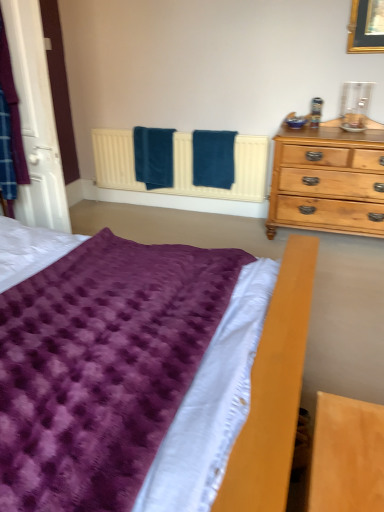
This screenshot has height=512, width=384. Describe the element at coordinates (127, 375) in the screenshot. I see `purple fuzzy blanket at lower left` at that location.

What is the approximate height of blue soft towel at center, which is the first bath towel from left to right?

blue soft towel at center, which is the first bath towel from left to right, is 21.89 inches in height.

I want to click on blue soft towel at center, marked as the second bath towel in a right-to-left arrangement, so [153, 157].

At what (x,y) coordinates should I click in order to perform the action: click on teal soft towel at center, the 1th bath towel from the right. Please return your answer as a coordinate pair (x, y). Looking at the image, I should click on [213, 158].

From the picture: Relative to teal soft towel at center, the 1th bath towel from the right, is purple fuzzy blanket at lower left in front or behind?

purple fuzzy blanket at lower left is in front of teal soft towel at center, the 1th bath towel from the right.

Is purple fuzzy blanket at lower left spatially inside teal soft towel at center, the 1th bath towel from the right, or outside of it?

purple fuzzy blanket at lower left is not inside teal soft towel at center, the 1th bath towel from the right, it's outside.

Is purple fuzzy blanket at lower left oriented away from teal soft towel at center, the 2th bath towel positioned from the left?

That's not correct — purple fuzzy blanket at lower left is not looking away from teal soft towel at center, the 2th bath towel positioned from the left.

From the picture: Considering the sizes of objects purple fuzzy blanket at lower left and teal soft towel at center, the 2th bath towel positioned from the left, in the image provided, who is taller, purple fuzzy blanket at lower left or teal soft towel at center, the 2th bath towel positioned from the left,?

purple fuzzy blanket at lower left.

Is teal soft towel at center, the 2th bath towel positioned from the left, in contact with purple fuzzy blanket at lower left?

No, teal soft towel at center, the 2th bath towel positioned from the left, is not making contact with purple fuzzy blanket at lower left.

Is teal soft towel at center, the 1th bath towel from the right, facing towards purple fuzzy blanket at lower left?

Yes, teal soft towel at center, the 1th bath towel from the right, is aimed at purple fuzzy blanket at lower left.

From a real-world perspective, is teal soft towel at center, the 2th bath towel positioned from the left, above or below purple fuzzy blanket at lower left?

In terms of real-world spatial position, teal soft towel at center, the 2th bath towel positioned from the left, is below purple fuzzy blanket at lower left.

Is teal soft towel at center, the 2th bath towel positioned from the left, wider than purple fuzzy blanket at lower left?

In fact, teal soft towel at center, the 2th bath towel positioned from the left, might be narrower than purple fuzzy blanket at lower left.

Can blue soft towel at center, which is the first bath towel from left to right, be found inside teal soft towel at center, the 1th bath towel from the right?

No, blue soft towel at center, which is the first bath towel from left to right, is not surrounded by teal soft towel at center, the 1th bath towel from the right.

Is teal soft towel at center, the 2th bath towel positioned from the left, not close to blue soft towel at center, marked as the second bath towel in a right-to-left arrangement?

No.

Can you confirm if teal soft towel at center, the 1th bath towel from the right, is bigger than blue soft towel at center, marked as the second bath towel in a right-to-left arrangement?

Actually, teal soft towel at center, the 1th bath towel from the right, might be smaller than blue soft towel at center, marked as the second bath towel in a right-to-left arrangement.

Is point (201, 177) more distant than point (138, 145)?

No, it is in front of (138, 145).

Where is `bath towel on the right of blue soft towel at center, marked as the second bath towel in a right-to-left arrangement`? This screenshot has height=512, width=384. bath towel on the right of blue soft towel at center, marked as the second bath towel in a right-to-left arrangement is located at coordinates pyautogui.click(x=213, y=158).

In the image, is blue soft towel at center, which is the first bath towel from left to right, on the left side or the right side of teal soft towel at center, the 1th bath towel from the right?

From the image, it's evident that blue soft towel at center, which is the first bath towel from left to right, is to the left of teal soft towel at center, the 1th bath towel from the right.

Could you tell me if blue soft towel at center, which is the first bath towel from left to right, is turned towards teal soft towel at center, the 1th bath towel from the right?

No, blue soft towel at center, which is the first bath towel from left to right, is not turned towards teal soft towel at center, the 1th bath towel from the right.

Is blue soft towel at center, which is the first bath towel from left to right, further to camera compared to teal soft towel at center, the 2th bath towel positioned from the left?

Yes, it is.

From a real-world perspective, is blue soft towel at center, which is the first bath towel from left to right, physically above purple fuzzy blanket at lower left?

No, from a real-world perspective, blue soft towel at center, which is the first bath towel from left to right, is not on top of purple fuzzy blanket at lower left.

Between blue soft towel at center, which is the first bath towel from left to right, and purple fuzzy blanket at lower left, which one has larger width?

Wider between the two is purple fuzzy blanket at lower left.

Does blue soft towel at center, which is the first bath towel from left to right, have a greater height compared to purple fuzzy blanket at lower left?

No, blue soft towel at center, which is the first bath towel from left to right, is not taller than purple fuzzy blanket at lower left.

From a real-world perspective, is purple fuzzy blanket at lower left positioned above or below blue soft towel at center, marked as the second bath towel in a right-to-left arrangement?

In terms of real-world spatial position, purple fuzzy blanket at lower left is above blue soft towel at center, marked as the second bath towel in a right-to-left arrangement.

Is purple fuzzy blanket at lower left thinner than blue soft towel at center, marked as the second bath towel in a right-to-left arrangement?

In fact, purple fuzzy blanket at lower left might be wider than blue soft towel at center, marked as the second bath towel in a right-to-left arrangement.

Is purple fuzzy blanket at lower left inside or outside of blue soft towel at center, which is the first bath towel from left to right?

purple fuzzy blanket at lower left is outside blue soft towel at center, which is the first bath towel from left to right.

Is point (148, 252) closer to camera compared to point (162, 150)?

Yes, it is.

I want to click on bed in front of the teal soft towel at center, the 2th bath towel positioned from the left, so click(x=127, y=375).

In order to click on bed lying below the teal soft towel at center, the 2th bath towel positioned from the left (from the image's perspective) in this screenshot , I will do `click(127, 375)`.

Estimate the real-world distances between objects in this image. Which object is closer to blue soft towel at center, which is the first bath towel from left to right, purple fuzzy blanket at lower left or teal soft towel at center, the 2th bath towel positioned from the left?

teal soft towel at center, the 2th bath towel positioned from the left.

Which object lies further to the anchor point teal soft towel at center, the 2th bath towel positioned from the left, purple fuzzy blanket at lower left or blue soft towel at center, marked as the second bath towel in a right-to-left arrangement?

Among the two, purple fuzzy blanket at lower left is located further to teal soft towel at center, the 2th bath towel positioned from the left.

Which object lies further to the anchor point blue soft towel at center, marked as the second bath towel in a right-to-left arrangement, teal soft towel at center, the 1th bath towel from the right, or purple fuzzy blanket at lower left?

purple fuzzy blanket at lower left lies further to blue soft towel at center, marked as the second bath towel in a right-to-left arrangement, than the other object.

Considering their positions, is teal soft towel at center, the 2th bath towel positioned from the left, positioned further to purple fuzzy blanket at lower left than blue soft towel at center, marked as the second bath towel in a right-to-left arrangement?

blue soft towel at center, marked as the second bath towel in a right-to-left arrangement, is further to purple fuzzy blanket at lower left.

Based on their spatial positions, is blue soft towel at center, marked as the second bath towel in a right-to-left arrangement, or teal soft towel at center, the 2th bath towel positioned from the left, closer to purple fuzzy blanket at lower left?

teal soft towel at center, the 2th bath towel positioned from the left, is closer to purple fuzzy blanket at lower left.

Which object lies further to the anchor point teal soft towel at center, the 2th bath towel positioned from the left, blue soft towel at center, marked as the second bath towel in a right-to-left arrangement, or purple fuzzy blanket at lower left?

purple fuzzy blanket at lower left lies further to teal soft towel at center, the 2th bath towel positioned from the left, than the other object.

Find the location of a particular element. bath towel between purple fuzzy blanket at lower left and blue soft towel at center, which is the first bath towel from left to right, from front to back is located at coordinates (213, 158).